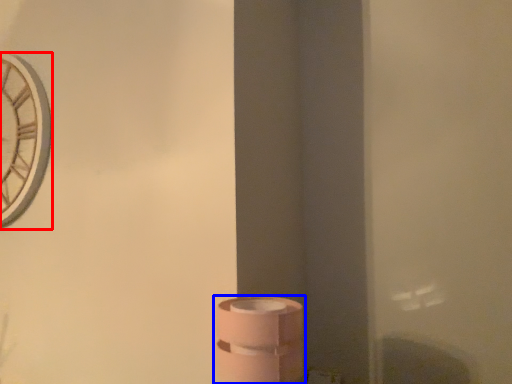
Question: Which point is further to the camera, clock (highlighted by a red box) or toilet paper (highlighted by a blue box)?

Choices:
 (A) clock
 (B) toilet paper

Answer: (A)